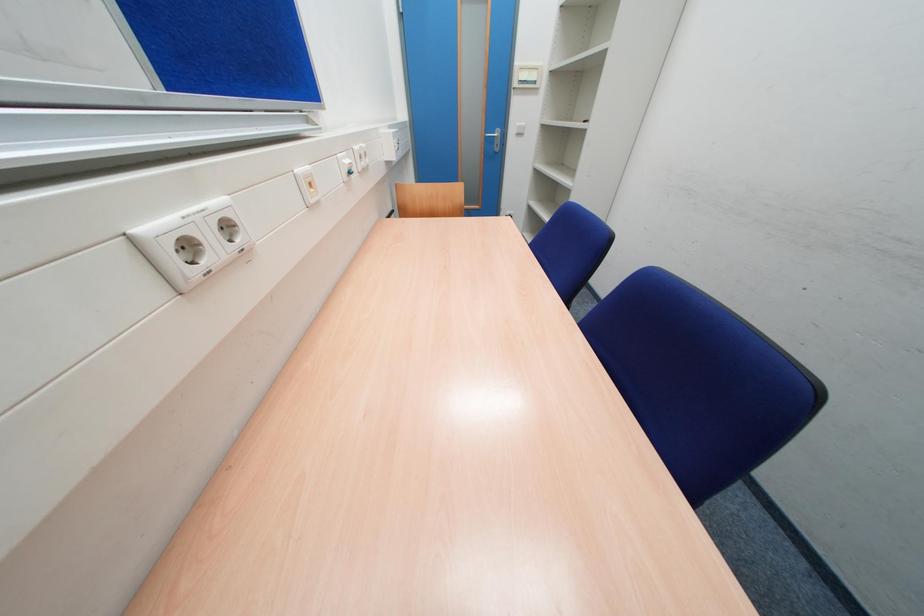
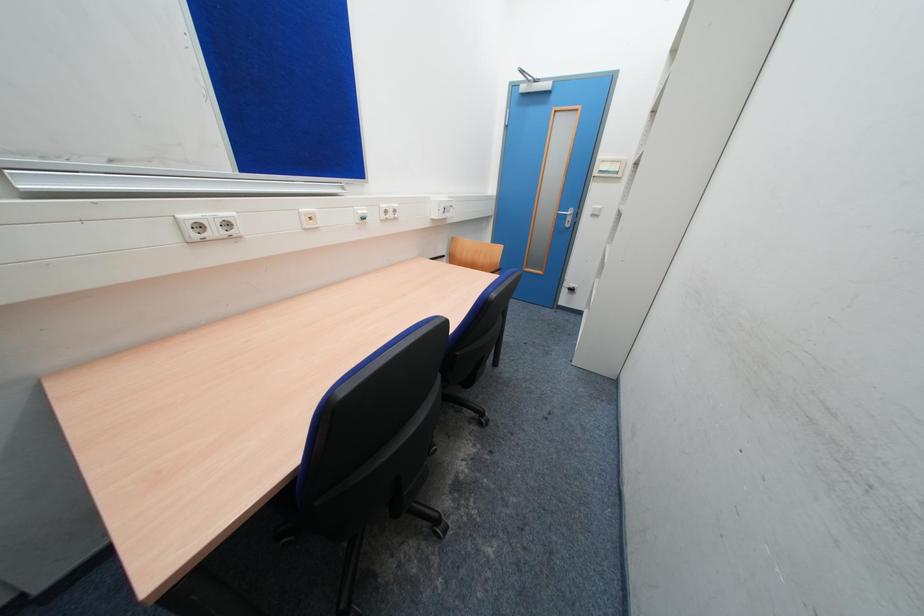
Question: The images are taken continuously from a first-person perspective. In which direction is your viewpoint rotating?

Choices:
 (A) Left
 (B) Right
 (C) Up
 (D) Down

Answer: (A)